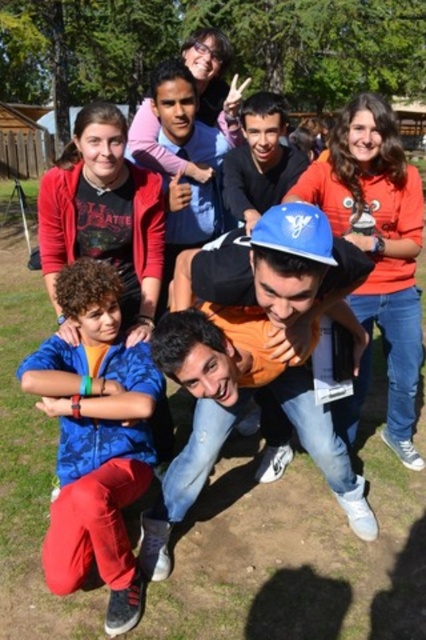
Question: Does blue hard hat at center have a lesser width compared to blue fabric shirt at lower left?

Choices:
 (A) yes
 (B) no

Answer: (B)

Question: Can you confirm if blue hard hat at center is positioned below blue fabric shirt at lower left?

Choices:
 (A) no
 (B) yes

Answer: (A)

Question: Which point is closer to the camera?

Choices:
 (A) (166, 576)
 (B) (101, 483)

Answer: (B)

Question: Which of the following is the closest to the observer?

Choices:
 (A) (204, 374)
 (B) (135, 461)

Answer: (A)

Question: Is blue hard hat at center positioned at the back of blue fabric shirt at lower left?

Choices:
 (A) yes
 (B) no

Answer: (B)